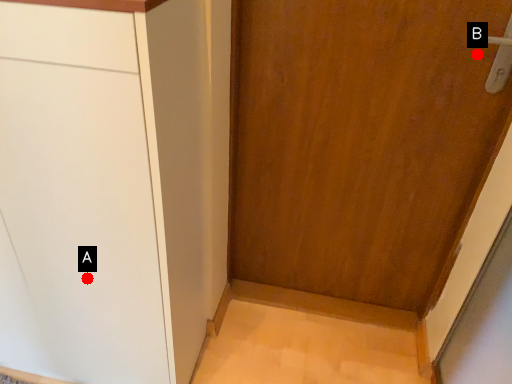
Question: Two points are circled on the image, labeled by A and B beside each circle. Which of the following is the farthest from the observer?

Choices:
 (A) A is further
 (B) B is further

Answer: (B)